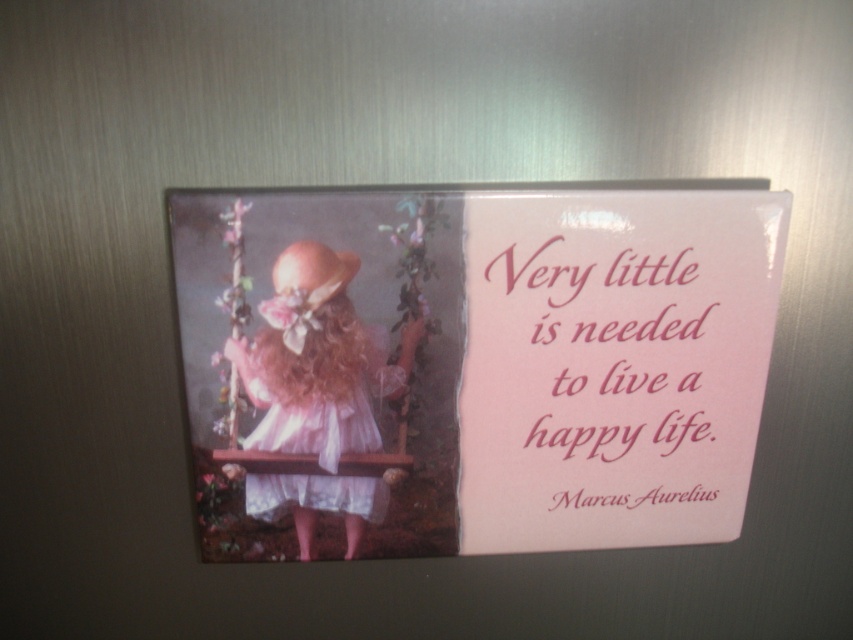
Question: Considering the relative positions of pink paper quote at upper right and pastel pink lace dress at center in the image provided, where is pink paper quote at upper right located with respect to pastel pink lace dress at center?

Choices:
 (A) right
 (B) left

Answer: (A)

Question: Is pastel pink lace dress at center smaller than pink satin dress at center?

Choices:
 (A) no
 (B) yes

Answer: (A)

Question: Which object is the closest to the pink satin dress at center?

Choices:
 (A) pink paper plaque at center
 (B) pink paper quote at upper right

Answer: (A)

Question: Which of the following is the closest to the observer?

Choices:
 (A) pink paper quote at upper right
 (B) pink paper plaque at center

Answer: (B)

Question: Which point is farther to the camera?

Choices:
 (A) (318, 509)
 (B) (311, 502)
 (C) (178, 232)

Answer: (A)

Question: Can you confirm if pink paper plaque at center is positioned to the left of pastel pink lace dress at center?

Choices:
 (A) no
 (B) yes

Answer: (A)